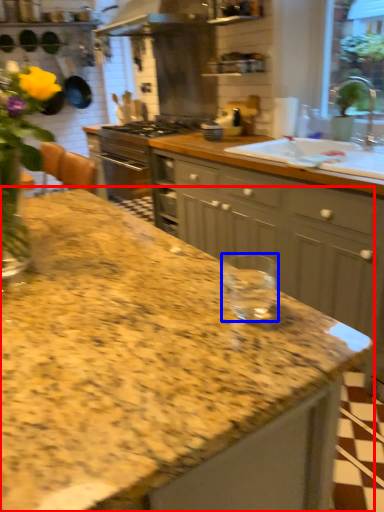
Question: Among these objects, which one is farthest to the camera, countertop (highlighted by a red box) or glass jar (highlighted by a blue box)?

Choices:
 (A) countertop
 (B) glass jar

Answer: (A)